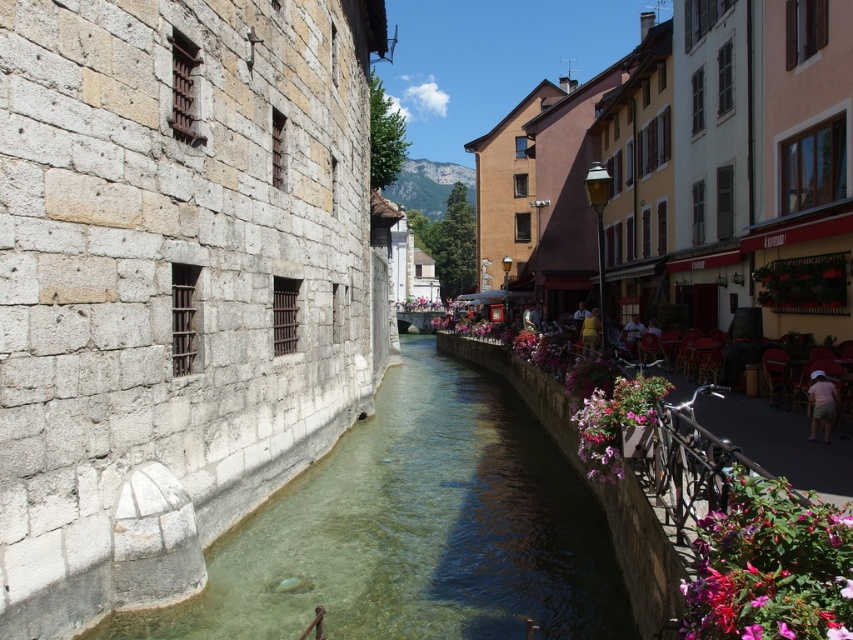
You are a photographer planning to capture the clear stone stream at center and the pink matte flowers at lower right in a single shot. Given their sizes, which object should you focus on to ensure both are in frame without needing to zoom in or out?

The clear stone stream at center has a larger size compared to the pink matte flowers at lower right, so focusing on the clear stone stream at center will ensure both are in frame without needing to adjust the zoom.

In the scene shown: You are a tourist standing on the cobblestone street near the canal. You see the pink matte flowers at lower right and the pink fabric flowers at right. Which one is positioned lower in the scene?

The pink matte flowers at lower right is positioned lower than the pink fabric flowers at right.

You are standing on the cobblestone street near the yellow fabric person at center. You want to cross the canal to the other side where the large stone wall with barred windows is located. Can you safely walk across the clear stone stream at center to reach the other side?

The distance between the yellow fabric person at center and the clear stone stream at center is 7.49 meters. Since the stream is clear and shallow, it is safe to walk across the clear stone stream at center to reach the other side.